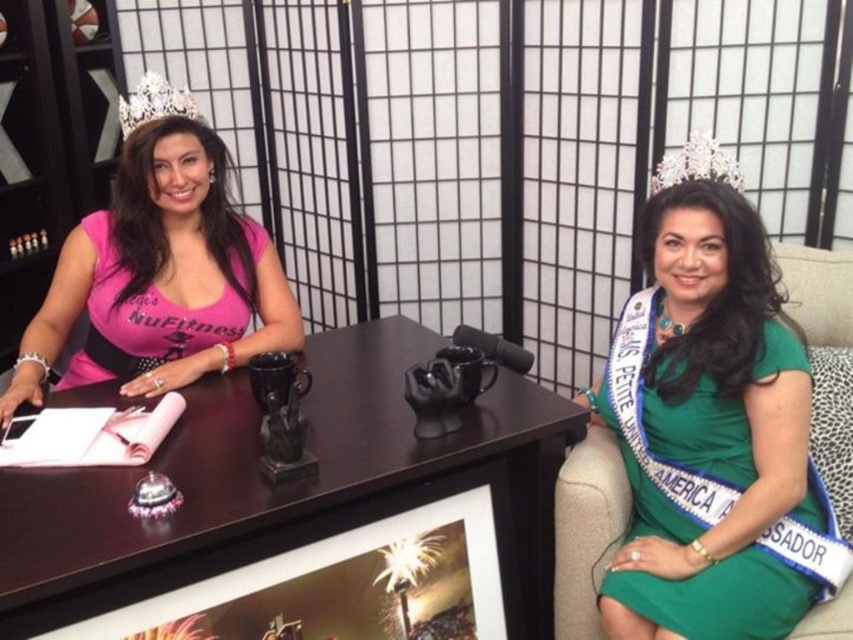
Question: Is green satin dress at center smaller than pearl/sparkling crown at upper right?

Choices:
 (A) yes
 (B) no

Answer: (B)

Question: Which object appears farthest from the camera in this image?

Choices:
 (A) pearl/sparkling crown at upper right
 (B) pink matte t-shirt at left
 (C) silver metallic crown at upper left
 (D) pink matte shirt at left

Answer: (B)

Question: From the image, what is the correct spatial relationship of pink matte shirt at left in relation to pink matte t-shirt at left?

Choices:
 (A) below
 (B) above

Answer: (A)

Question: Which point appears closest to the camera in this image?

Choices:
 (A) (131, 173)
 (B) (196, 321)

Answer: (A)

Question: Does green satin dress at center lie behind pearl/sparkling crown at upper right?

Choices:
 (A) yes
 (B) no

Answer: (B)

Question: Which of the following is the closest to the observer?

Choices:
 (A) (7, 529)
 (B) (167, 108)

Answer: (A)